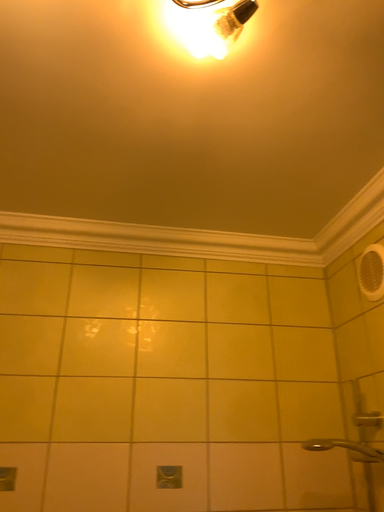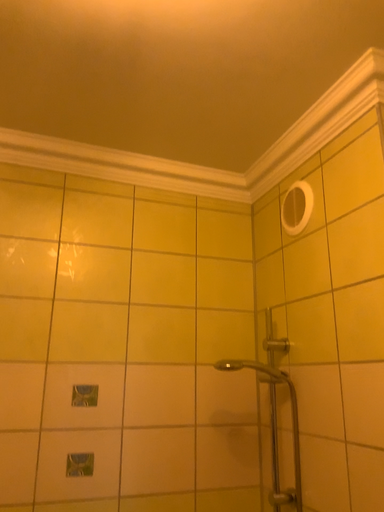
Question: How did the camera likely rotate when shooting the video?

Choices:
 (A) rotated left
 (B) rotated right

Answer: (B)